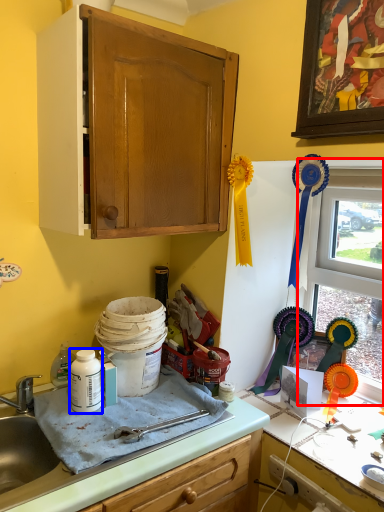
Question: Among these objects, which one is nearest to the camera, window (highlighted by a red box) or bottle (highlighted by a blue box)?

Choices:
 (A) window
 (B) bottle

Answer: (B)